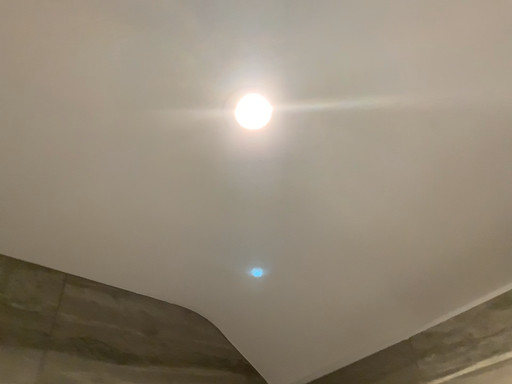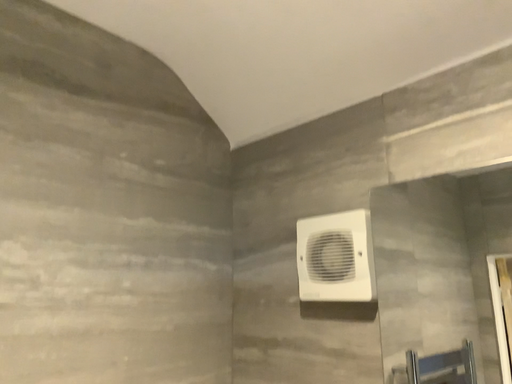
Question: How did the camera likely rotate when shooting the video?

Choices:
 (A) rotated downward
 (B) rotated upward

Answer: (A)